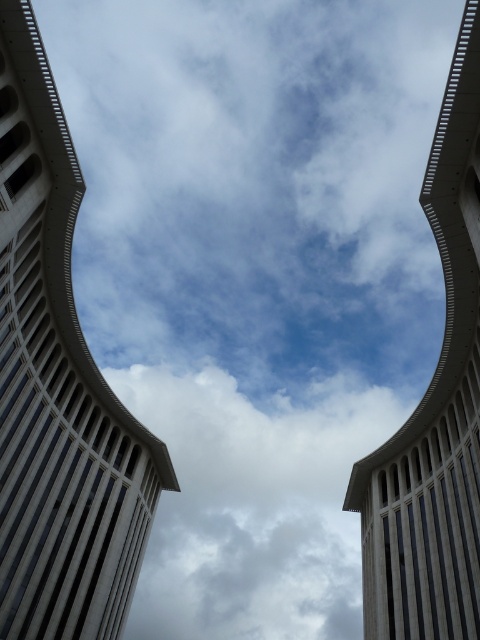
Between white concrete tower at upper left and white fluffy cloud at center, which one appears on the left side from the viewer's perspective?

Positioned to the left is white concrete tower at upper left.

Between point (21, 390) and point (225, 429), which one is positioned behind?

Point (225, 429)

Find the location of a particular element. The width and height of the screenshot is (480, 640). white concrete tower at upper left is located at coordinates (58, 387).

Locate an element on the screen. The height and width of the screenshot is (640, 480). white fluffy cloud at center is located at coordinates (253, 506).

Describe the element at coordinates (253, 506) in the screenshot. I see `white fluffy cloud at center` at that location.

Find the location of a particular element. This screenshot has height=640, width=480. white fluffy cloud at center is located at coordinates (253, 506).

Which is more to the right, white concrete tower at upper left or gray concrete tower at center?

gray concrete tower at center is more to the right.

Is white concrete tower at upper left wider than gray concrete tower at center?

No.

Does point (22, 452) lie behind point (443, 600)?

Yes.

Locate an element on the screen. The width and height of the screenshot is (480, 640). white concrete tower at upper left is located at coordinates point(58,387).